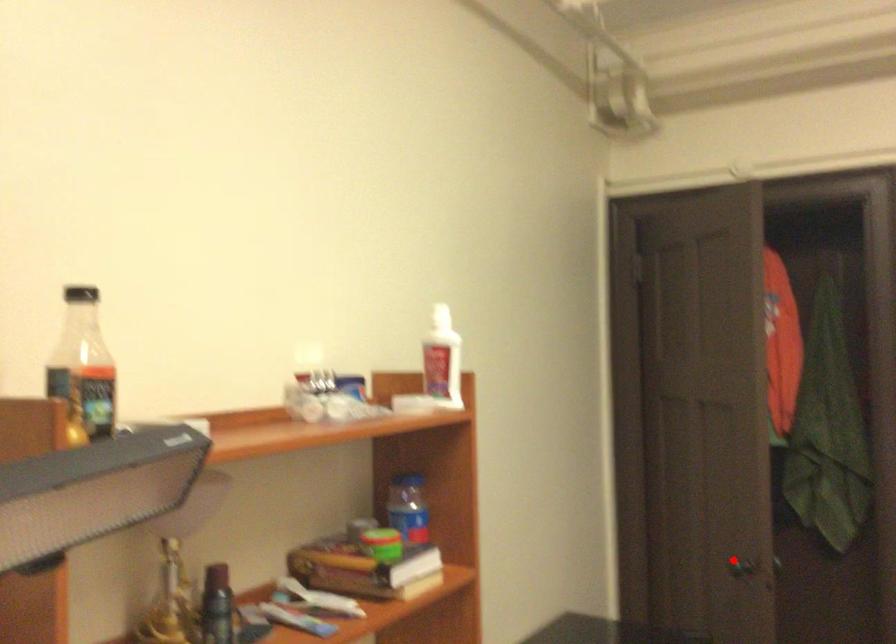
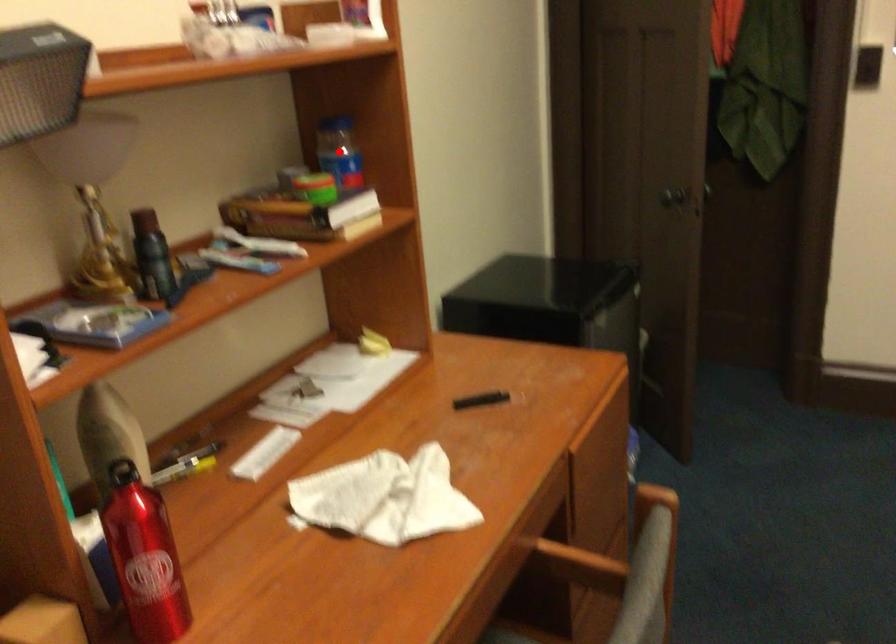
I am providing you with two images of the same scene from different viewpoints. A red point is marked on the first image and another point is marked on the second image. Are the points marked in image1 and image2 representing the same 3D position?

No